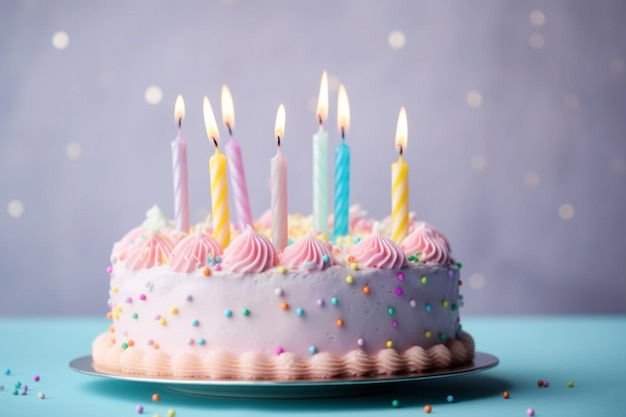
At what (x,y) coordinates should I click in order to perform the action: click on candles. Please return your answer as a coordinate pair (x, y). This screenshot has width=626, height=417. Looking at the image, I should click on (178, 193), (222, 200), (245, 196), (287, 197), (320, 192), (339, 192), (399, 194).